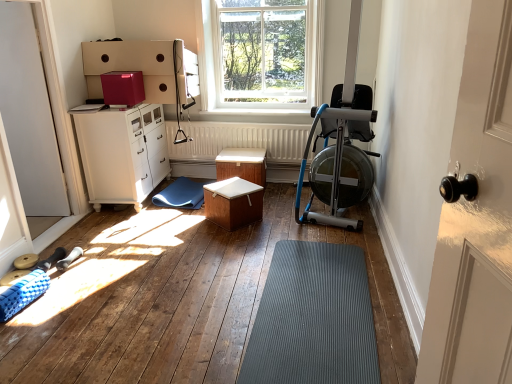
The width and height of the screenshot is (512, 384). Describe the element at coordinates (339, 159) in the screenshot. I see `blue metallic rowing machine at right` at that location.

The width and height of the screenshot is (512, 384). What are the coordinates of `white matte radiator at center` in the screenshot? It's located at (239, 141).

Measure the distance between point (168, 205) and camera.

The distance of point (168, 205) from camera is 3.76 meters.

Describe the element at coordinates (242, 164) in the screenshot. I see `wooden table at center, which ranks as the first table in back-to-front order` at that location.

At what (x,y) coordinates should I click in order to perform the action: click on blue metallic rowing machine at right. Please return your answer as a coordinate pair (x, y). Looking at the image, I should click on (339, 159).

Would you say blue metallic rowing machine at right is a long distance from wooden table at center, which ranks as the first table in back-to-front order?

blue metallic rowing machine at right is actually quite close to wooden table at center, which ranks as the first table in back-to-front order.

Which object is more forward, blue metallic rowing machine at right or wooden table at center, acting as the second table starting from the front?

blue metallic rowing machine at right is closer to the camera.

Looking at their sizes, would you say blue metallic rowing machine at right is wider or thinner than wooden table at center, which ranks as the first table in back-to-front order?

In the image, blue metallic rowing machine at right appears to be wider than wooden table at center, which ranks as the first table in back-to-front order.

From the image's perspective, which is above, white matte wooden box at center, the first table viewed from the front, or wooden table at center, acting as the second table starting from the front?

From the image's view, wooden table at center, acting as the second table starting from the front, is above.

Are white matte wooden box at center, the first table viewed from the front, and wooden table at center, which ranks as the first table in back-to-front order, located far from each other?

No, white matte wooden box at center, the first table viewed from the front, is not far away from wooden table at center, which ranks as the first table in back-to-front order.

From a real-world perspective, between white matte wooden box at center, the second table positioned from the back, and wooden table at center, acting as the second table starting from the front, who is vertically lower?

white matte wooden box at center, the second table positioned from the back, is physically lower.

Which is closer, (156, 195) or (130, 119)?

Point (156, 195) appears to be farther away from the viewer than point (130, 119).

Considering the sizes of objects blue rubber mat at lower left and white glossy cabinet at left in the image provided, who is smaller, blue rubber mat at lower left or white glossy cabinet at left?

Smaller between the two is blue rubber mat at lower left.

In the image, is blue rubber mat at lower left on the left side or the right side of white glossy cabinet at left?

Based on their positions, blue rubber mat at lower left is located to the right of white glossy cabinet at left.

Locate an element on the screen. mat behind the white glossy cabinet at left is located at coordinates click(x=181, y=195).

In the scene shown: Do you think blue rubber mat at lower left is within gray rubber mat at center, or outside of it?

blue rubber mat at lower left is not enclosed by gray rubber mat at center.

Is blue rubber mat at lower left to the right of gray rubber mat at center from the viewer's perspective?

Incorrect, blue rubber mat at lower left is not on the right side of gray rubber mat at center.

Measure the distance between blue rubber mat at lower left and gray rubber mat at center.

The distance of blue rubber mat at lower left from gray rubber mat at center is 1.70 meters.

Does blue rubber mat at lower left lie behind gray rubber mat at center?

Yes, blue rubber mat at lower left is further from the viewer.

From the image's perspective, would you say blue metallic rowing machine at right is positioned over white matte wooden box at center, the second table positioned from the back?

Yes, from the image's perspective, blue metallic rowing machine at right is over white matte wooden box at center, the second table positioned from the back.

Who is taller, blue metallic rowing machine at right or white matte wooden box at center, the first table viewed from the front?

blue metallic rowing machine at right is taller.

Is blue metallic rowing machine at right oriented towards white matte wooden box at center, the second table positioned from the back?

→ No.

Which is less distant, (x=334, y=149) or (x=214, y=24)?

Clearly, point (x=334, y=149) is closer to the camera than point (x=214, y=24).

Considering the positions of objects blue metallic rowing machine at right and clear glass window at upper center in the image provided, who is more to the right, blue metallic rowing machine at right or clear glass window at upper center?

blue metallic rowing machine at right.

How distant is blue metallic rowing machine at right from clear glass window at upper center?

blue metallic rowing machine at right is 5.32 feet from clear glass window at upper center.

How different are the orientations of blue rubber mat at lower left and white matte radiator at center in degrees?

5.1 degrees separate the facing orientations of blue rubber mat at lower left and white matte radiator at center.

Is blue rubber mat at lower left positioned with its back to white matte radiator at center?

No, blue rubber mat at lower left is not facing away from white matte radiator at center.

Is blue rubber mat at lower left smaller than white matte radiator at center?

Indeed, blue rubber mat at lower left has a smaller size compared to white matte radiator at center.

Is blue rubber mat at lower left spatially inside white matte radiator at center, or outside of it?

blue rubber mat at lower left lies outside white matte radiator at center.

Starting from the blue metallic rowing machine at right, which table is the 2nd one behind? Please provide its 2D coordinates.

[(242, 164)]

Identify the location of table above the white matte wooden box at center, the first table viewed from the front (from the image's perspective). (242, 164).

Which object lies further to the anchor point white glossy cabinet at left, wooden table at center, acting as the second table starting from the front, or white matte wooden box at center, the first table viewed from the front?

white matte wooden box at center, the first table viewed from the front.

Based on their spatial positions, is blue metallic rowing machine at right or white matte door at left closer to gray rubber mat at center?

blue metallic rowing machine at right.

When comparing their distances from blue rubber mat at lower left, does clear glass window at upper center or gray rubber mat at center seem closer?

Among the two, clear glass window at upper center is located nearer to blue rubber mat at lower left.

Considering their positions, is white matte door at left positioned closer to blue metallic rowing machine at right than wooden table at center, which ranks as the first table in back-to-front order?

wooden table at center, which ranks as the first table in back-to-front order.

Estimate the real-world distances between objects in this image. Which object is closer to white glossy cabinet at left, wooden table at center, which ranks as the first table in back-to-front order, or white matte door at left?

The object closer to white glossy cabinet at left is white matte door at left.

Considering their positions, is white matte wooden box at center, the second table positioned from the back, positioned further to white glossy cabinet at left than gray rubber mat at center?

gray rubber mat at center is positioned further to the anchor white glossy cabinet at left.

Based on their spatial positions, is white matte wooden box at center, the first table viewed from the front, or wooden table at center, which ranks as the first table in back-to-front order, closer to gray rubber mat at center?

white matte wooden box at center, the first table viewed from the front.

Based on their spatial positions, is white matte wooden box at center, the first table viewed from the front, or white matte door at left closer to clear glass window at upper center?

Based on the image, white matte wooden box at center, the first table viewed from the front, appears to be nearer to clear glass window at upper center.

Locate an element on the screen. mat that lies between clear glass window at upper center and white matte wooden box at center, the first table viewed from the front, from top to bottom is located at coordinates (181, 195).

Find the location of a particular element. This screenshot has height=384, width=512. table between white matte wooden box at center, the first table viewed from the front, and white matte radiator at center from front to back is located at coordinates (242, 164).

This screenshot has height=384, width=512. I want to click on chest of drawers between clear glass window at upper center and blue rubber mat at lower left from top to bottom, so (122, 153).

Identify the location of chest of drawers between clear glass window at upper center and white matte wooden box at center, the first table viewed from the front, in the up-down direction. The height and width of the screenshot is (384, 512). [x=122, y=153].